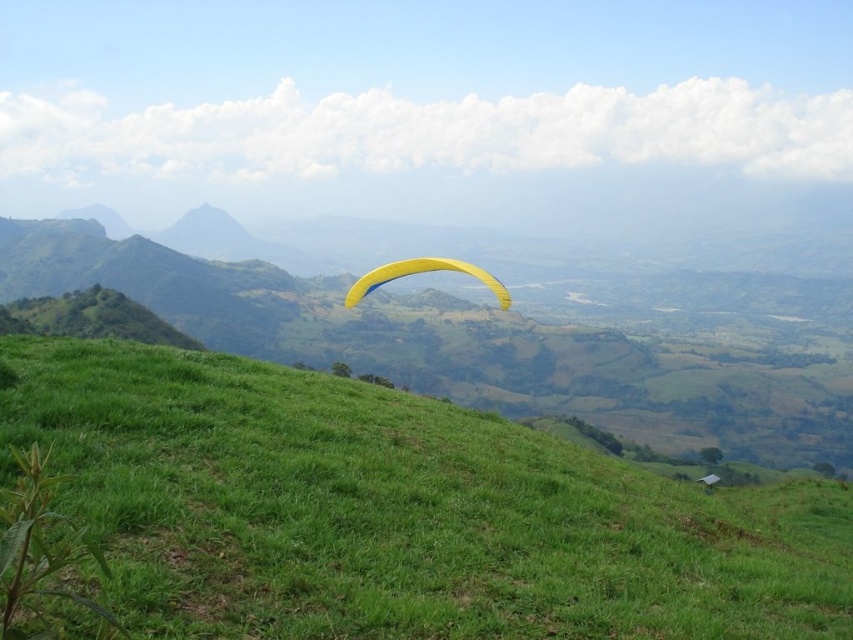
Does green grassy hillside at lower center have a greater width compared to yellow fabric parachute at center?

Yes.

Is the position of green grassy hillside at lower center more distant than that of yellow fabric parachute at center?

No, green grassy hillside at lower center is closer to the viewer.

Find the location of a particular element. The height and width of the screenshot is (640, 853). green grassy hillside at lower center is located at coordinates (399, 513).